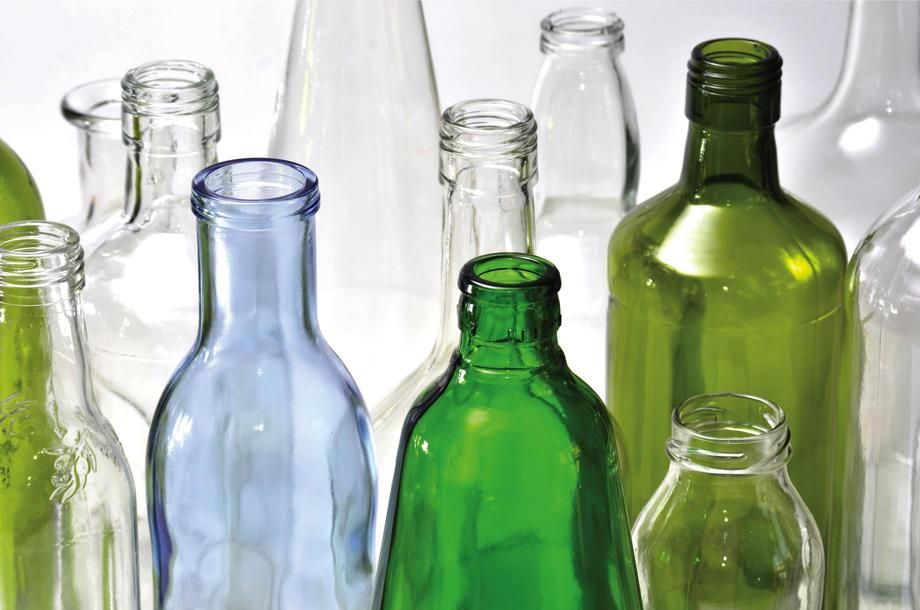
Locate an element on the screen. colored glass is located at coordinates (26, 196), (279, 402), (464, 414), (704, 271).